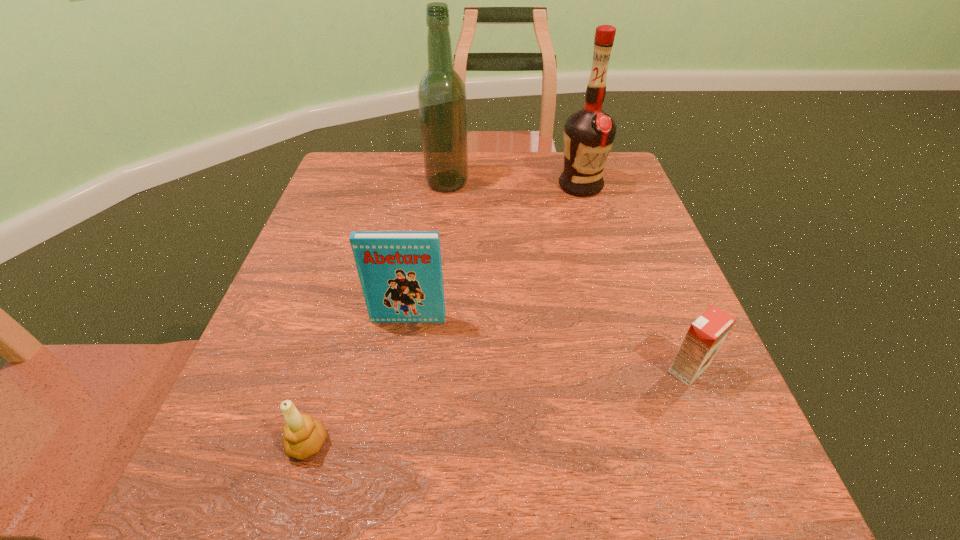
This screenshot has width=960, height=540. I want to click on the left liquor, so click(442, 99).

Find the location of `the right liquor`. the right liquor is located at coordinates (589, 133).

This screenshot has height=540, width=960. I want to click on the third tallest object, so click(400, 272).

Image resolution: width=960 pixels, height=540 pixels. I want to click on book, so click(x=400, y=272).

At what (x,y) coordinates should I click in order to perform the action: click on the fourth farthest object. Please return your answer as a coordinate pair (x, y). The width and height of the screenshot is (960, 540). Looking at the image, I should click on (706, 334).

The height and width of the screenshot is (540, 960). I want to click on the leftmost object, so click(304, 436).

This screenshot has width=960, height=540. Identify the location of the nearest object. (304, 436).

You are a GUI agent. You are given a task and a screenshot of the screen. Output one action in this format:
    pyautogui.click(x=<x>, y=<y>)
    Task: Click on the free location located 0.290m on the right of the left liquor
    The height and width of the screenshot is (540, 960).
    Given the screenshot: What is the action you would take?
    pyautogui.click(x=580, y=183)

Where is `vacant region located 0.370m on the front and back of the right liquor`? vacant region located 0.370m on the front and back of the right liquor is located at coordinates (617, 310).

Where is `vacant space situated 0.340m on the front cover of the third nearest object`? The height and width of the screenshot is (540, 960). vacant space situated 0.340m on the front cover of the third nearest object is located at coordinates (376, 528).